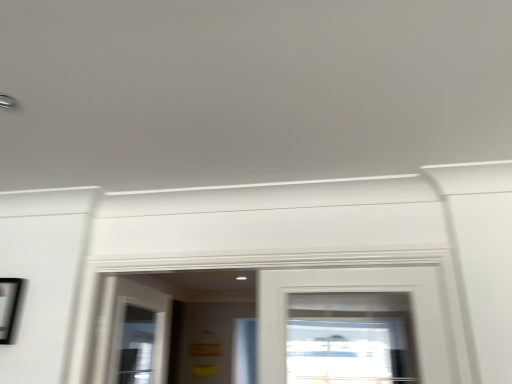
This screenshot has height=384, width=512. What do you see at coordinates (9, 306) in the screenshot?
I see `black matte picture frame at left` at bounding box center [9, 306].

Locate an element on the screen. The height and width of the screenshot is (384, 512). black matte picture frame at left is located at coordinates (9, 306).

Where is `black matte picture frame at left`? Image resolution: width=512 pixels, height=384 pixels. black matte picture frame at left is located at coordinates (9, 306).